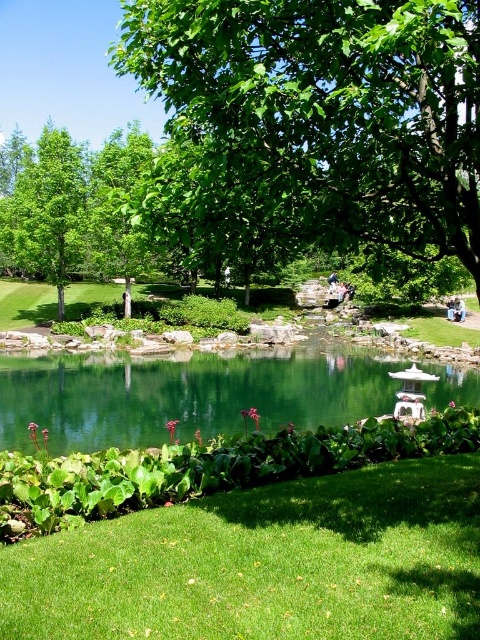
You are a gardener who needs to place a 20 meter long decorative fence between the green grass at lower center and the green glossy lake at center. Is there enough space to place the fence between them?

The distance between the green grass at lower center and the green glossy lake at center is 20.81 meters. Since the fence is 20 meters long, there is enough space to place it between them as the distance is slightly longer than the fence.

In the scene shown: You are a gardener who wants to plant a new flower bed. You have two options for locations in the garden scene shown. The first option is near the green grass at lower center, and the second option is near the green leafy tree at upper left. Considering the height differences between these two areas, which location might be better for a flower bed that requires shorter plants?

The green grass at lower center has a lesser height compared to the green leafy tree at upper left. Therefore, the area near the green grass at lower center would be better for a flower bed requiring shorter plants since it is lower in elevation.

You are planning to place a 3 meter wide garden bench in this garden. Based on the scene, which object from the green grass at lower center and the green leafy tree at upper left would you consider for placement to ensure the bench fits without overlapping?

The green grass at lower center has a width less than the green leafy tree at upper left. Since the bench is 3 meters wide, the green leafy tree at upper left has sufficient width to accommodate the bench placement without overlapping.